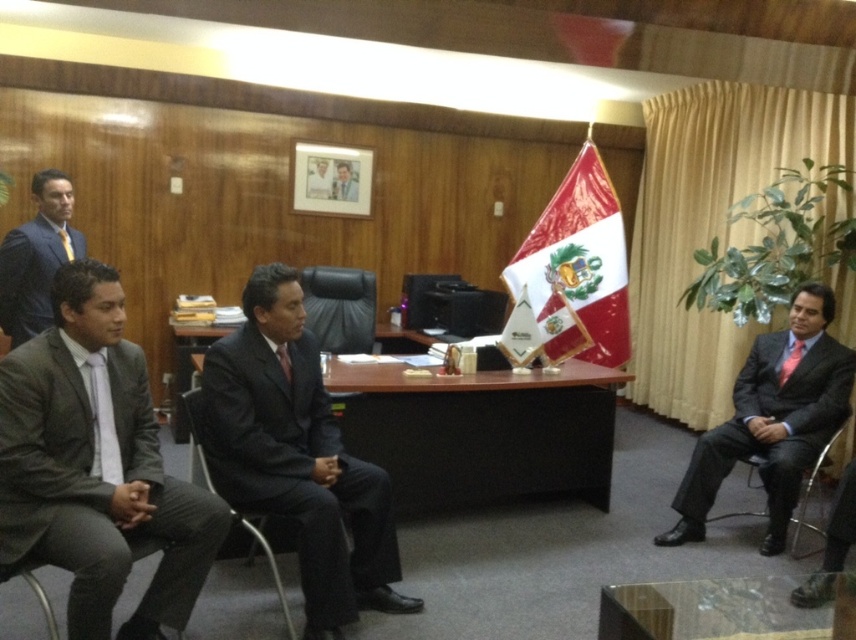
Is transparent glass table at lower center bigger than metallic silver chair at right?

Actually, transparent glass table at lower center might be smaller than metallic silver chair at right.

Is transparent glass table at lower center to the left of metallic silver chair at right from the viewer's perspective?

Correct, you'll find transparent glass table at lower center to the left of metallic silver chair at right.

Locate an element on the screen. transparent glass table at lower center is located at coordinates (722, 611).

Between black fabric chair at right and black leather chair at center, which one has less height?

black leather chair at center

Who is more distant from viewer, (795, 497) or (352, 273)?

Point (352, 273)

What are the coordinates of `black fabric chair at right` in the screenshot? It's located at (749, 467).

Find the location of `black fabric chair at right`. black fabric chair at right is located at coordinates (749, 467).

Consider the image. How much distance is there between matte gray suit at left and metallic gray chair at lower left?

matte gray suit at left and metallic gray chair at lower left are 13.80 inches apart from each other.

Who is shorter, matte gray suit at left or metallic gray chair at lower left?

With less height is metallic gray chair at lower left.

Measure the distance between point (43, 333) and camera.

Point (43, 333) is 7.52 feet away from camera.

You are a GUI agent. You are given a task and a screenshot of the screen. Output one action in this format:
    pyautogui.click(x=<x>, y=<y>)
    Task: Click on the matte gray suit at left
    The image size is (856, 640).
    Given the screenshot: What is the action you would take?
    pyautogui.click(x=96, y=467)